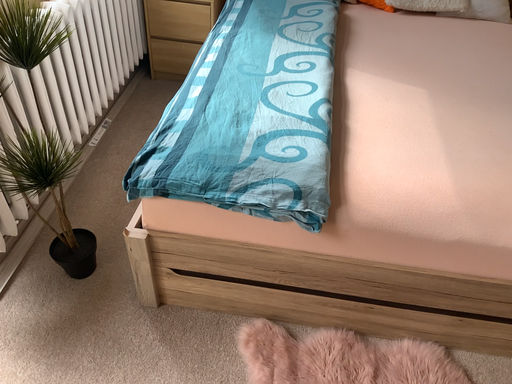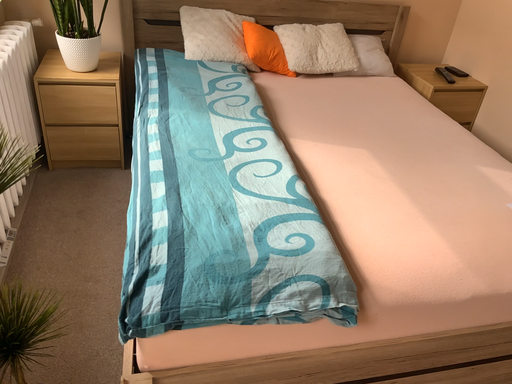
Question: Which way did the camera rotate in the video?

Choices:
 (A) rotated downward
 (B) rotated upward

Answer: (B)